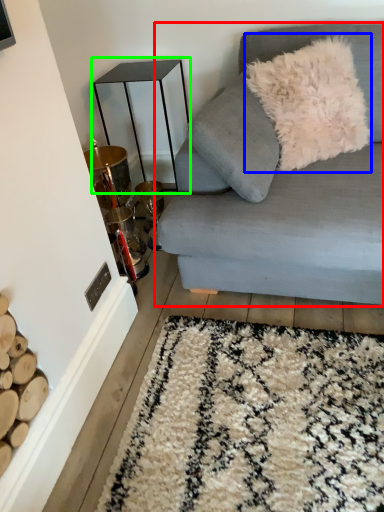
Question: Based on their relative distances, which object is farther from studio couch (highlighted by a red box)? Choose from throw pillow (highlighted by a blue box) and table (highlighted by a green box).

Choices:
 (A) throw pillow
 (B) table

Answer: (B)